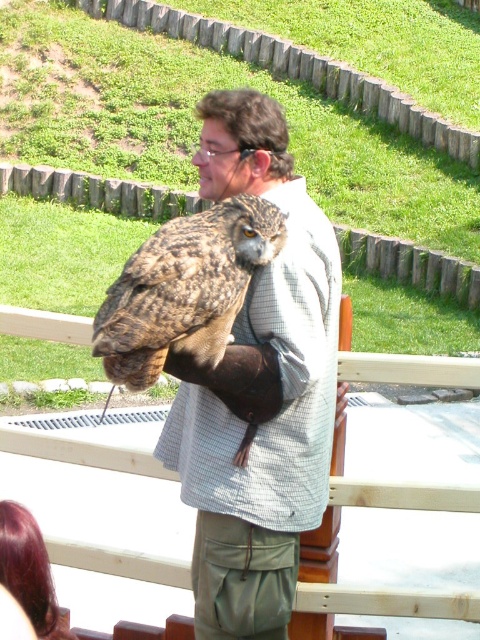
In the scene shown: You are a photographer standing at the camera position. You want to take a photo of the large owl perched on the person arm. The owl is at point (x=283, y=461). You have a lens that can focus on objects up to 3 meters away. Will you be able to focus on the owl?

The point (x=283, y=461) where the owl is located is 3.28 meters away from the camera. Since the lens can only focus up to 3 meters, the owl is slightly out of range. You won t be able to focus on the owl with this lens.

You are a photographer trying to capture a closeup shot of the matte brown owl at upper center. The camera you are using has a minimum focusing distance of 10 feet. Based on the scene, will you be able to take the photo without moving closer?

The matte brown owl at upper center is 9.76 feet from the camera, which is within the minimum focusing distance of 10 feet. Therefore, you can take the photo without moving closer.

In the scene shown: You are a wildlife photographer aiming to capture both the matte brown owl at upper center and the brown feathered owl at center in a single shot. Given their sizes, which owl should you focus on to ensure both are visible without needing to zoom in or out?

The matte brown owl at upper center is larger than the brown feathered owl at center. To capture both without adjusting zoom, focus on the matte brown owl at upper center first, then adjust slightly towards the smaller one to ensure both are in frame.